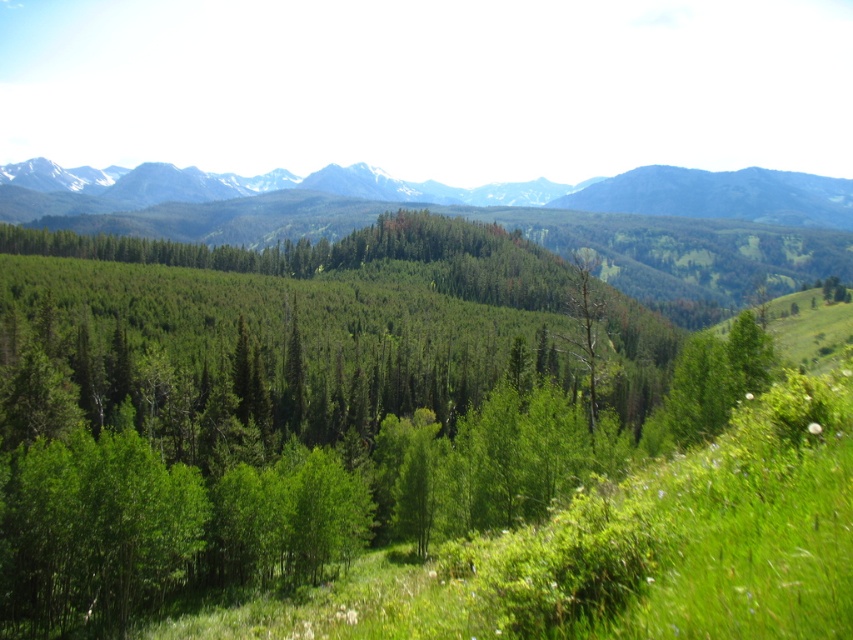
Question: Which of these objects is positioned closest to the snowy rocky mountain range at upper center?

Choices:
 (A) green leafy tree at center
 (B) dead wood tree at center

Answer: (B)

Question: Does green leafy tree at center appear under dead wood tree at center?

Choices:
 (A) yes
 (B) no

Answer: (A)

Question: Among these points, which one is farthest from the camera?

Choices:
 (A) (563, 188)
 (B) (141, 442)

Answer: (A)

Question: Does green leafy tree at center have a smaller size compared to snowy rocky mountain range at upper center?

Choices:
 (A) yes
 (B) no

Answer: (A)

Question: Considering the real-world distances, which object is closest to the dead wood tree at center?

Choices:
 (A) green leafy tree at center
 (B) snowy rocky mountain range at upper center

Answer: (A)

Question: From the image, what is the correct spatial relationship of green leafy tree at center in relation to dead wood tree at center?

Choices:
 (A) above
 (B) below

Answer: (B)